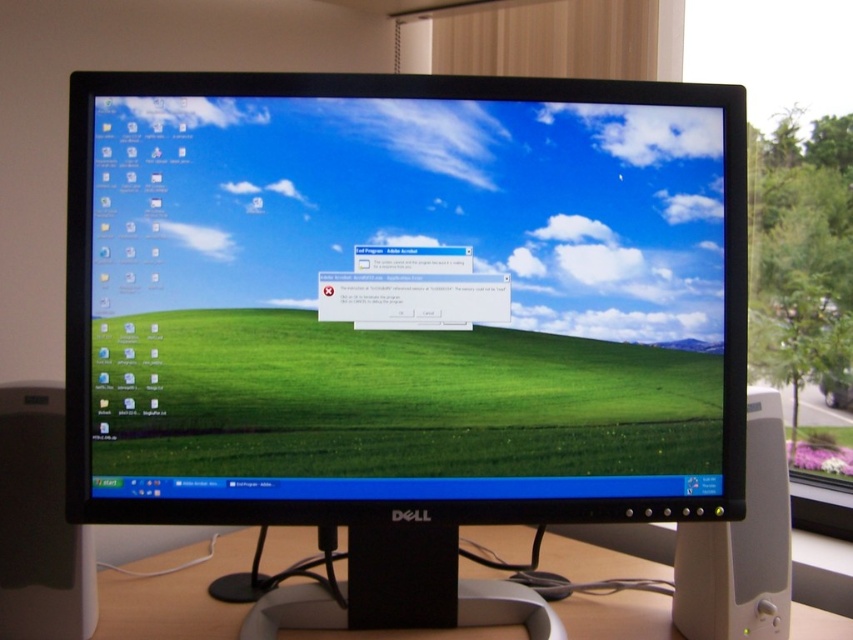
Who is shorter, matte plastic monitor at center or white plastic computer desk at center?

Standing shorter between the two is white plastic computer desk at center.

Identify the location of matte plastic monitor at center. The height and width of the screenshot is (640, 853). (410, 300).